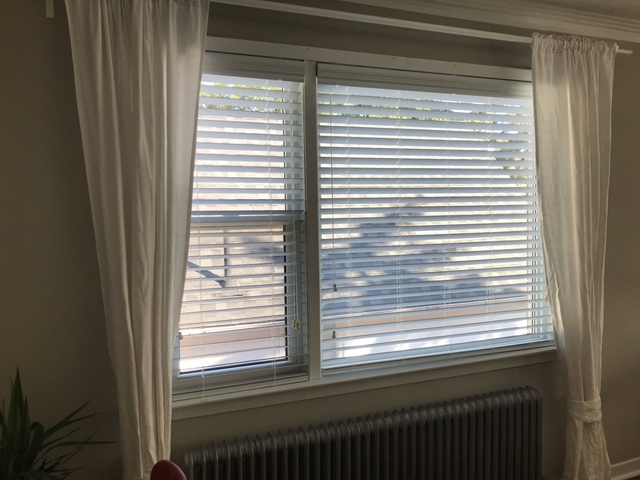
Find the location of a particular element. floor is located at coordinates (637, 478).